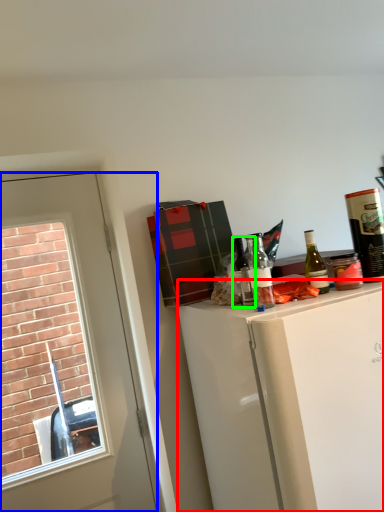
Question: Estimate the real-world distances between objects in this image. Which object is farther from cabinetry (highlighted by a red box), door (highlighted by a blue box) or bottle (highlighted by a green box)?

Choices:
 (A) door
 (B) bottle

Answer: (A)